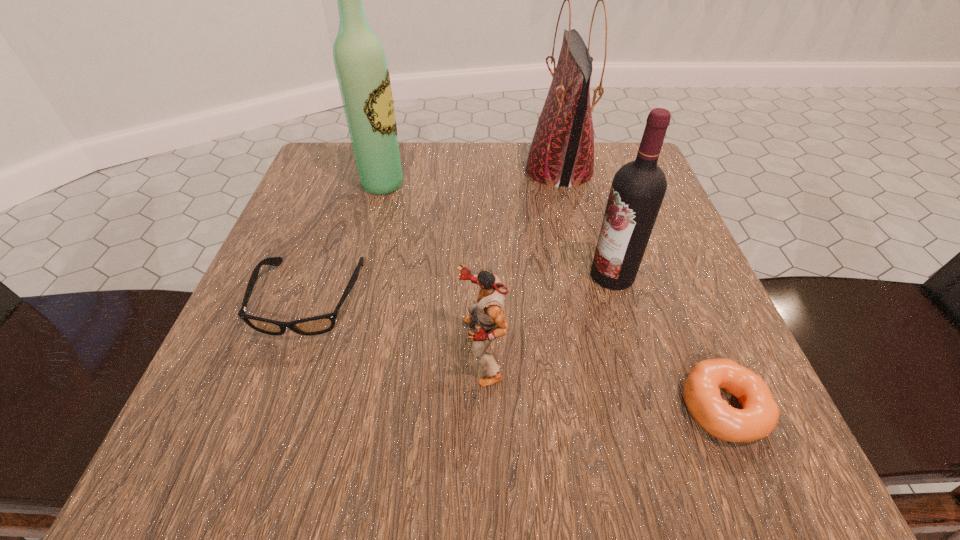
The image size is (960, 540). I want to click on the taller wine bottle, so click(x=362, y=72).

Where is `the tallest object`? the tallest object is located at coordinates (362, 72).

Find the location of a particular element. Image resolution: width=960 pixels, height=540 pixels. handbag is located at coordinates pos(562,151).

Find the location of a particular element. the fourth shortest object is located at coordinates (638, 188).

At what (x,y) coordinates should I click in order to perform the action: click on the right wine bottle. Please return your answer as a coordinate pair (x, y). This screenshot has height=540, width=960. Looking at the image, I should click on (638, 188).

Identify the location of the fourth object from right to left. (487, 316).

You are a GUI agent. You are given a task and a screenshot of the screen. Output one action in this format:
    pyautogui.click(x=<x>, y=<y>)
    Task: Click on the puncher
    Image resolution: width=960 pixels, height=540 pixels.
    Given the screenshot: What is the action you would take?
    pyautogui.click(x=487, y=316)

The width and height of the screenshot is (960, 540). Identify the location of spectacles. (x=317, y=325).

Locate an element on the screen. doughnut is located at coordinates (758, 417).

This screenshot has width=960, height=540. I want to click on free point located 0.260m on the front-facing side of the taller wine bottle, so click(x=527, y=184).